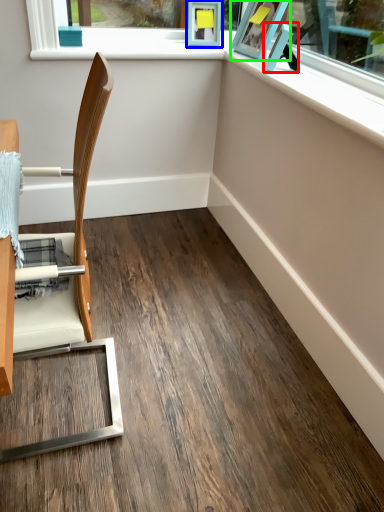
Question: Considering the real-world distances, which object is closest to picture frame (highlighted by a red box)? picture frame (highlighted by a blue box) or picture frame (highlighted by a green box).

Choices:
 (A) picture frame
 (B) picture frame

Answer: (B)